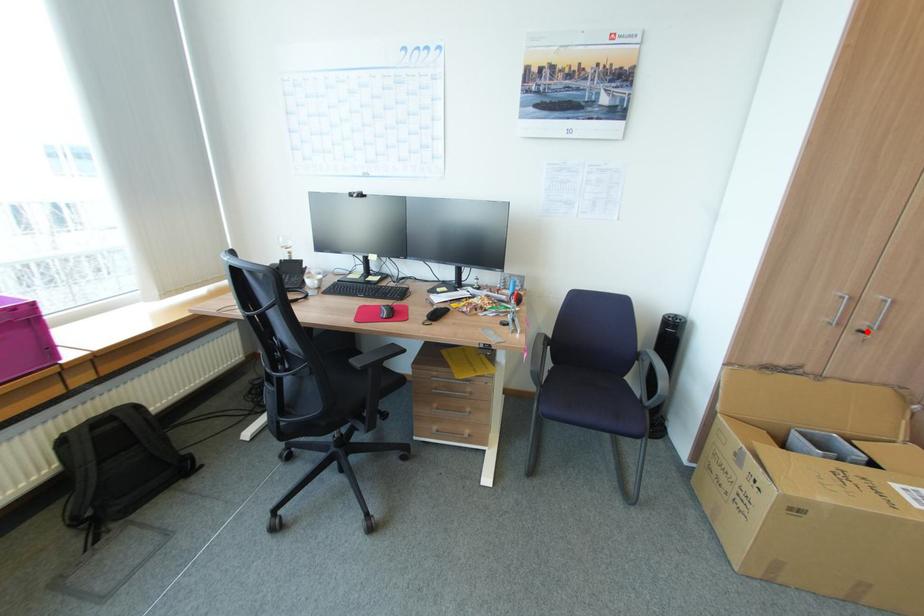
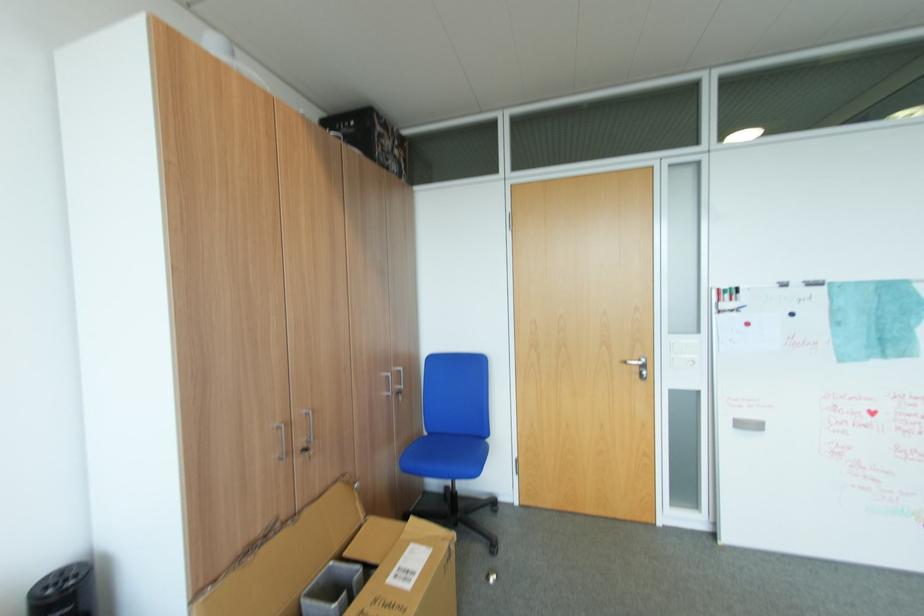
Where in the second image is the point corresponding to the highlighted location from the first image?

(310, 451)